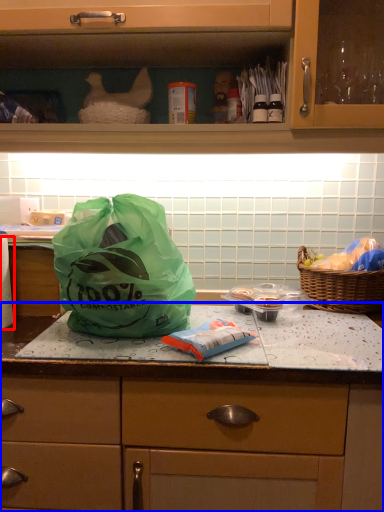
Question: Which object is closer to the camera taking this photo, toilet paper (highlighted by a red box) or countertop (highlighted by a blue box)?

Choices:
 (A) toilet paper
 (B) countertop

Answer: (B)